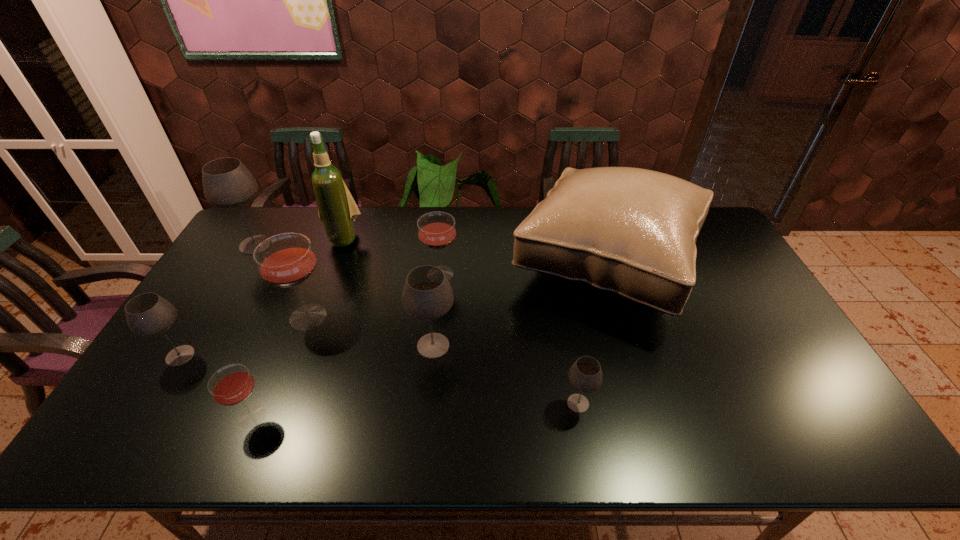
This screenshot has width=960, height=540. Identify the location of wine bottle. (337, 210).

Find the location of `gray cushion`. gray cushion is located at coordinates (629, 232).

At what (x,y) coordinates should I click in order to perform the action: click on the tallest wineglass. Please return your answer as a coordinate pair (x, y). This screenshot has width=960, height=540. Looking at the image, I should click on (227, 183).

Identify the location of the farthest wineglass. (227, 183).

At what (x,y) coordinates should I click in order to perform the action: click on the biggest red wineglass. Please return your answer as a coordinate pair (x, y). The width and height of the screenshot is (960, 540). Looking at the image, I should click on (286, 260).

You are a GUI agent. You are given a task and a screenshot of the screen. Output one action in this format:
    pyautogui.click(x=<x>, y=<y>)
    Task: Click on the third smallest gray wineglass
    
    Given the screenshot: What is the action you would take?
    pyautogui.click(x=427, y=294)

The width and height of the screenshot is (960, 540). Find the location of `the second smallest red wineglass`. the second smallest red wineglass is located at coordinates (436, 230).

Identify the location of the rightmost red wineglass. This screenshot has height=540, width=960. (436, 230).

Where is `the third biggest gray wineglass`? This screenshot has height=540, width=960. the third biggest gray wineglass is located at coordinates (148, 314).

Identify the location of the smallest red wineglass. (231, 385).